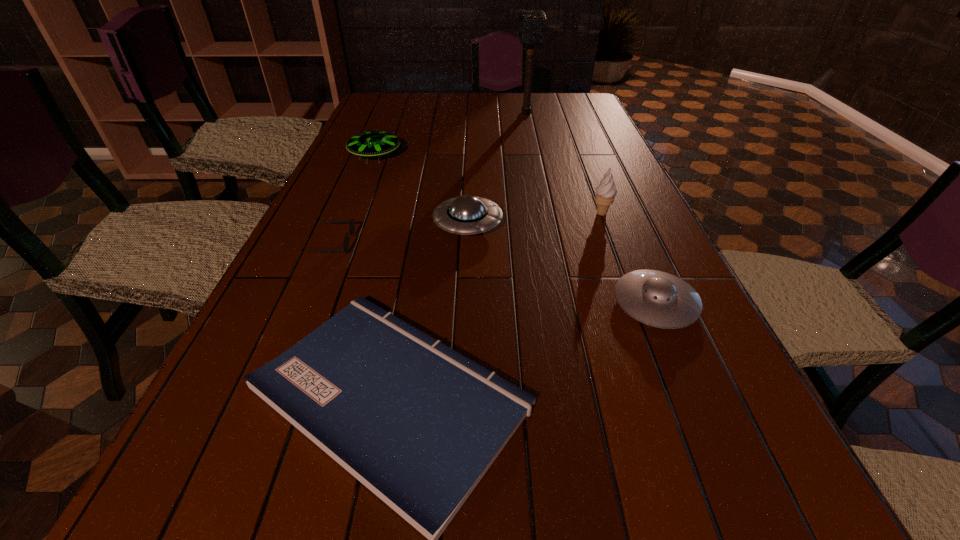
Image resolution: width=960 pixels, height=540 pixels. In order to click on vacant point located 0.240m on the front-facing side of the icecream in this screenshot , I will do `click(627, 280)`.

The image size is (960, 540). I want to click on free space located 0.200m on the right of the leftmost saucer, so click(464, 156).

The height and width of the screenshot is (540, 960). In order to click on vacant region located 0.360m on the right of the second saucer from left to right in this screenshot , I will do `click(643, 224)`.

Find the location of a particular element. The height and width of the screenshot is (540, 960). vacant space situated on the front of the fifth tallest object is located at coordinates (746, 517).

Find the location of a particular element. Image resolution: width=960 pixels, height=540 pixels. free region located 0.160m on the front-facing side of the sunglasses is located at coordinates (418, 244).

Identify the location of object at the far edge. (532, 23).

This screenshot has height=540, width=960. I want to click on saucer present at the left edge, so click(x=371, y=143).

Locate an element on the screen. The height and width of the screenshot is (540, 960). sunglasses that is at the left edge is located at coordinates (352, 223).

At what (x,y) coordinates should I click in order to perform the action: click on icecream located in the right edge section of the desktop. Please return your answer as a coordinate pair (x, y). The image size is (960, 540). Looking at the image, I should click on (605, 193).

At what (x,y) coordinates should I click in order to perform the action: click on saucer located at the right edge. Please return your answer as a coordinate pair (x, y). The height and width of the screenshot is (540, 960). Looking at the image, I should click on coord(658,299).